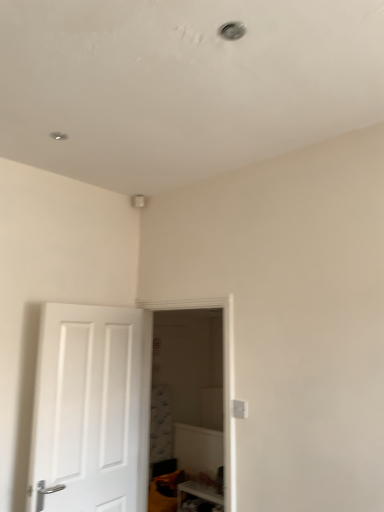
Question: Is white glossy shelf at lower right taller than white matte door at left?

Choices:
 (A) yes
 (B) no

Answer: (B)

Question: Does white glossy shelf at lower right have a smaller size compared to white matte door at left?

Choices:
 (A) no
 (B) yes

Answer: (B)

Question: Is white glossy shelf at lower right thinner than white matte door at left?

Choices:
 (A) no
 (B) yes

Answer: (A)

Question: Does white glossy shelf at lower right appear on the left side of white matte door at left?

Choices:
 (A) yes
 (B) no

Answer: (B)

Question: Are white glossy shelf at lower right and white matte door at left located far from each other?

Choices:
 (A) yes
 (B) no

Answer: (A)

Question: In terms of size, does transparent glass door at center appear bigger or smaller than white glossy shelf at lower right?

Choices:
 (A) big
 (B) small

Answer: (A)

Question: Considering the positions of transparent glass door at center and white glossy shelf at lower right in the image, is transparent glass door at center taller or shorter than white glossy shelf at lower right?

Choices:
 (A) short
 (B) tall

Answer: (B)

Question: Considering the positions of point (228, 309) and point (198, 483), is point (228, 309) closer or farther from the camera than point (198, 483)?

Choices:
 (A) farther
 (B) closer

Answer: (B)

Question: From the image's perspective, is transparent glass door at center positioned above or below white glossy shelf at lower right?

Choices:
 (A) below
 (B) above

Answer: (B)

Question: Looking at their shapes, would you say white glossy shelf at lower right is wider or thinner than white matte door at left?

Choices:
 (A) thin
 (B) wide

Answer: (B)

Question: Relative to white matte door at left, is white glossy shelf at lower right in front or behind?

Choices:
 (A) behind
 (B) front

Answer: (A)

Question: Considering the positions of white glossy shelf at lower right and white matte door at left in the image, is white glossy shelf at lower right bigger or smaller than white matte door at left?

Choices:
 (A) small
 (B) big

Answer: (A)

Question: Is white glossy shelf at lower right taller or shorter than white matte door at left?

Choices:
 (A) tall
 (B) short

Answer: (B)

Question: Is point (54, 452) positioned closer to the camera than point (205, 494)?

Choices:
 (A) farther
 (B) closer

Answer: (B)

Question: Is white matte door at left taller or shorter than white glossy shelf at lower right?

Choices:
 (A) short
 (B) tall

Answer: (B)